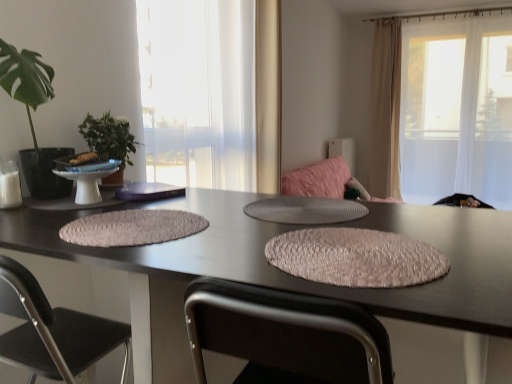
The height and width of the screenshot is (384, 512). Describe the element at coordinates (132, 228) in the screenshot. I see `textured beige placemat at center, which is counted as the 1th yoga mat, starting from the left` at that location.

How much space does textured beige placemat at center, which is the 2th yoga mat in right-to-left order, occupy vertically?

It is 0.91 inches.

Looking at this image, measure the distance between point (x=141, y=285) and camera.

Point (x=141, y=285) is 37.09 inches from camera.

This screenshot has width=512, height=384. Describe the element at coordinates (305, 210) in the screenshot. I see `matte gray placemat at center` at that location.

This screenshot has height=384, width=512. In order to click on green leafy plant at left, which appears as the 1th houseplant when viewed from the back in this screenshot , I will do `click(109, 142)`.

The width and height of the screenshot is (512, 384). I want to click on green leafy plant at left, positioned as the first houseplant in front-to-back order, so (x=31, y=117).

Describe the element at coordinates (31, 117) in the screenshot. This screenshot has width=512, height=384. I see `green leafy plant at left, which appears as the second houseplant when viewed from the back` at that location.

What is the approximate height of translucent fabric window at upper right, the first window positioned from the right?

translucent fabric window at upper right, the first window positioned from the right, is 7.77 feet in height.

In order to face translucent fabric window at upper right, the first window positioned from the right, should I rotate leftwards or rightwards?

To face it directly, rotate right by 24.836 degrees.

Where is `translucent glass window at center, the 2th window viewed from the back`? The height and width of the screenshot is (384, 512). translucent glass window at center, the 2th window viewed from the back is located at coordinates (198, 92).

I want to click on round table below the green leafy plant at left, which appears as the second houseplant when viewed from the back (from a real-world perspective), so click(305, 210).

From a real-world perspective, is matte gray placemat at center located beneath green leafy plant at left, positioned as the first houseplant in front-to-back order?

Yes.

Which object is further away from the camera, matte gray placemat at center or green leafy plant at left, positioned as the first houseplant in front-to-back order?

green leafy plant at left, positioned as the first houseplant in front-to-back order, is behind.

Who is bigger, matte gray placemat at center or green leafy plant at left, positioned as the first houseplant in front-to-back order?

With larger size is green leafy plant at left, positioned as the first houseplant in front-to-back order.

Is point (458, 208) less distant than point (375, 106)?

Yes, it is in front of point (375, 106).

Is matte black table at center facing away from beige fabric curtain at upper right?

No.

Is matte black table at center bigger than beige fabric curtain at upper right?

Correct, matte black table at center is larger in size than beige fabric curtain at upper right.

Considering the positions of objects matte black table at center and beige fabric curtain at upper right in the image provided, who is behind, matte black table at center or beige fabric curtain at upper right?

beige fabric curtain at upper right is further away from the camera.

Is point (101, 230) positioned behind point (112, 146)?

No, it is not.

Is textured beige placemat at center, which is the 2th yoga mat in right-to-left order, oriented towards green leafy plant at left, positioned as the second houseplant in front-to-back order?

No, textured beige placemat at center, which is the 2th yoga mat in right-to-left order, is not aimed at green leafy plant at left, positioned as the second houseplant in front-to-back order.

Is textured beige placemat at center, which is the 2th yoga mat in right-to-left order, taller or shorter than green leafy plant at left, which appears as the 1th houseplant when viewed from the back?

Considering their sizes, textured beige placemat at center, which is the 2th yoga mat in right-to-left order, has less height than green leafy plant at left, which appears as the 1th houseplant when viewed from the back.

Between textured beige placemat at center, which is the 2th yoga mat in right-to-left order, and green leafy plant at left, positioned as the second houseplant in front-to-back order, which one has larger size?

Bigger between the two is green leafy plant at left, positioned as the second houseplant in front-to-back order.

From a real-world perspective, is textured beige placemat at center, arranged as the 1th yoga mat when viewed from the right, physically located above or below green leafy plant at left, which appears as the second houseplant when viewed from the back?

From a real-world perspective, textured beige placemat at center, arranged as the 1th yoga mat when viewed from the right, is physically below green leafy plant at left, which appears as the second houseplant when viewed from the back.

From the image's perspective, would you say textured beige placemat at center, arranged as the 1th yoga mat when viewed from the right, is shown under green leafy plant at left, positioned as the first houseplant in front-to-back order?

Correct, textured beige placemat at center, arranged as the 1th yoga mat when viewed from the right, appears lower than green leafy plant at left, positioned as the first houseplant in front-to-back order, in the image.

Which object is positioned more to the right, textured beige placemat at center, arranged as the 1th yoga mat when viewed from the right, or green leafy plant at left, which appears as the second houseplant when viewed from the back?

textured beige placemat at center, arranged as the 1th yoga mat when viewed from the right.

Which is in front, textured beige placemat at center, the second yoga mat in the left-to-right sequence, or green leafy plant at left, positioned as the first houseplant in front-to-back order?

textured beige placemat at center, the second yoga mat in the left-to-right sequence, is in front.

Considering the sizes of textured beige placemat at center, which is counted as the 1th yoga mat, starting from the left, and matte black table at center in the image, is textured beige placemat at center, which is counted as the 1th yoga mat, starting from the left, wider or thinner than matte black table at center?

Clearly, textured beige placemat at center, which is counted as the 1th yoga mat, starting from the left, has less width compared to matte black table at center.

Consider the image. Is textured beige placemat at center, which is the 2th yoga mat in right-to-left order, positioned behind matte black table at center?

Yes, textured beige placemat at center, which is the 2th yoga mat in right-to-left order, is further from the viewer.

Considering the sizes of objects textured beige placemat at center, which is counted as the 1th yoga mat, starting from the left, and matte black table at center in the image provided, who is taller, textured beige placemat at center, which is counted as the 1th yoga mat, starting from the left, or matte black table at center?

matte black table at center.

Are textured beige placemat at center, which is counted as the 1th yoga mat, starting from the left, and matte black table at center located far from each other?

They are positioned close to each other.

Is black fabric chair at lower left smaller than matte gray placemat at center?

Incorrect, black fabric chair at lower left is not smaller in size than matte gray placemat at center.

Who is shorter, black fabric chair at lower left or matte gray placemat at center?

Standing shorter between the two is matte gray placemat at center.

You are a GUI agent. You are given a task and a screenshot of the screen. Output one action in this format:
    pyautogui.click(x=<x>, y=<y>)
    Task: Click on the chair below the matte gray placemat at center (from the image's perspective)
    This screenshot has width=512, height=384.
    Given the screenshot: What is the action you would take?
    pyautogui.click(x=53, y=331)

Which is more to the right, black fabric chair at lower left or matte gray placemat at center?

From the viewer's perspective, matte gray placemat at center appears more on the right side.

Does black fabric chair at lower left lie in front of green leafy plant at left, which appears as the second houseplant when viewed from the back?

Yes, it is in front of green leafy plant at left, which appears as the second houseplant when viewed from the back.

How many degrees apart are the facing directions of black fabric chair at lower left and green leafy plant at left, which appears as the second houseplant when viewed from the back?

There is a 90-degree angle between the facing directions of black fabric chair at lower left and green leafy plant at left, which appears as the second houseplant when viewed from the back.

Is black fabric chair at lower left aimed at green leafy plant at left, which appears as the second houseplant when viewed from the back?

No, black fabric chair at lower left is not aimed at green leafy plant at left, which appears as the second houseplant when viewed from the back.

From the image's perspective, which one is positioned lower, black fabric chair at lower left or green leafy plant at left, positioned as the first houseplant in front-to-back order?

black fabric chair at lower left, from the image's perspective.

Image resolution: width=512 pixels, height=384 pixels. I want to click on round table that appears in front of the green leafy plant at left, which appears as the second houseplant when viewed from the back, so click(305, 210).

At what (x,y) coordinates should I click in order to perform the action: click on curtain above the matte black table at center (from the image's perspective). Please return your answer as a coordinate pair (x, y). Looking at the image, I should click on (385, 110).

Estimate the real-world distances between objects in this image. Which object is closer to textured beige placemat at center, which is counted as the 1th yoga mat, starting from the left, translucent fabric window at upper right, the first window positioned from the right, or green leafy plant at left, which appears as the second houseplant when viewed from the back?

green leafy plant at left, which appears as the second houseplant when viewed from the back.

Which object lies nearer to the anchor point matte gray placemat at center, translucent glass window at center, which appears as the 2th window when viewed from the right, or translucent fabric window at upper right, the first window positioned from the right?

translucent glass window at center, which appears as the 2th window when viewed from the right, is closer to matte gray placemat at center.

Considering their positions, is green leafy plant at left, which appears as the 1th houseplant when viewed from the back, positioned closer to green leafy plant at left, positioned as the first houseplant in front-to-back order, than beige fabric curtain at upper right?

The object closer to green leafy plant at left, positioned as the first houseplant in front-to-back order, is green leafy plant at left, which appears as the 1th houseplant when viewed from the back.

Considering their positions, is textured beige placemat at center, which is counted as the 1th yoga mat, starting from the left, positioned further to translucent fabric window at upper right, positioned as the 2th window in front-to-back order, than translucent glass window at center, which is the 1th window from left to right?

textured beige placemat at center, which is counted as the 1th yoga mat, starting from the left, is further to translucent fabric window at upper right, positioned as the 2th window in front-to-back order.

When comparing their distances from green leafy plant at left, positioned as the first houseplant in front-to-back order, does textured beige placemat at center, the second yoga mat in the left-to-right sequence, or green leafy plant at left, which appears as the 1th houseplant when viewed from the back, seem further?

textured beige placemat at center, the second yoga mat in the left-to-right sequence, is further to green leafy plant at left, positioned as the first houseplant in front-to-back order.

When comparing their distances from matte gray placemat at center, does beige fabric curtain at upper right or textured beige placemat at center, which is the 2th yoga mat in right-to-left order, seem further?

beige fabric curtain at upper right is further to matte gray placemat at center.

Estimate the real-world distances between objects in this image. Which object is further from textured beige placemat at center, the second yoga mat in the left-to-right sequence, translucent glass window at center, marked as the 1th window in a front-to-back arrangement, or green leafy plant at left, positioned as the first houseplant in front-to-back order?

The object further to textured beige placemat at center, the second yoga mat in the left-to-right sequence, is translucent glass window at center, marked as the 1th window in a front-to-back arrangement.

Estimate the real-world distances between objects in this image. Which object is closer to matte gray placemat at center, beige fabric curtain at upper right or matte black table at center?

matte black table at center lies closer to matte gray placemat at center than the other object.

Identify the location of yoga mat between green leafy plant at left, positioned as the first houseplant in front-to-back order, and matte gray placemat at center. The image size is (512, 384). (132, 228).

The width and height of the screenshot is (512, 384). I want to click on window between textured beige placemat at center, arranged as the 1th yoga mat when viewed from the right, and translucent fabric window at upper right, positioned as the first window in back-to-front order, in the front-back direction, so click(198, 92).

Locate an element on the screen. The width and height of the screenshot is (512, 384). chair between textured beige placemat at center, arranged as the 1th yoga mat when viewed from the right, and translucent glass window at center, the 2th window viewed from the back, from front to back is located at coordinates pyautogui.click(x=53, y=331).

This screenshot has height=384, width=512. Identify the location of chair positioned between textured beige placemat at center, the second yoga mat in the left-to-right sequence, and green leafy plant at left, positioned as the second houseplant in front-to-back order, from near to far. (53, 331).